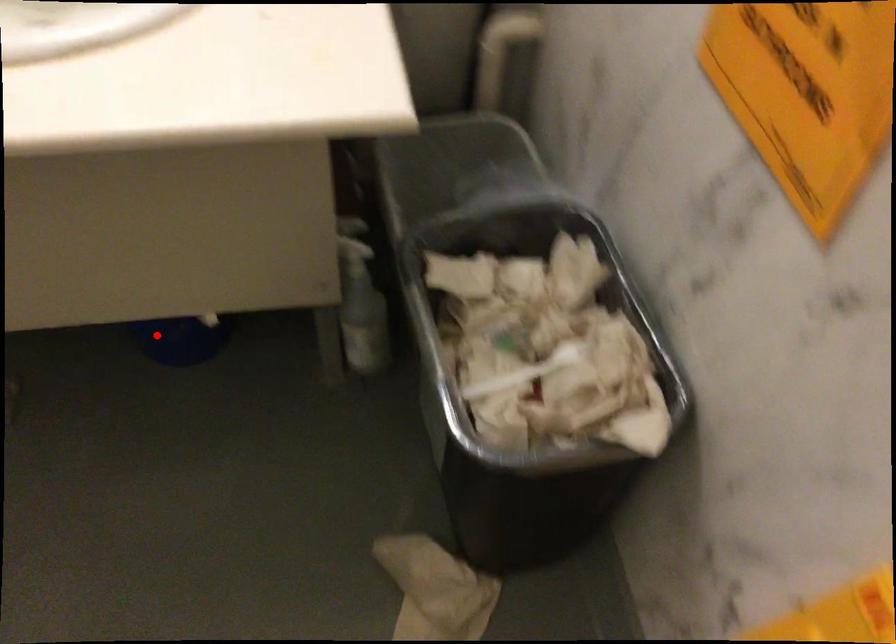
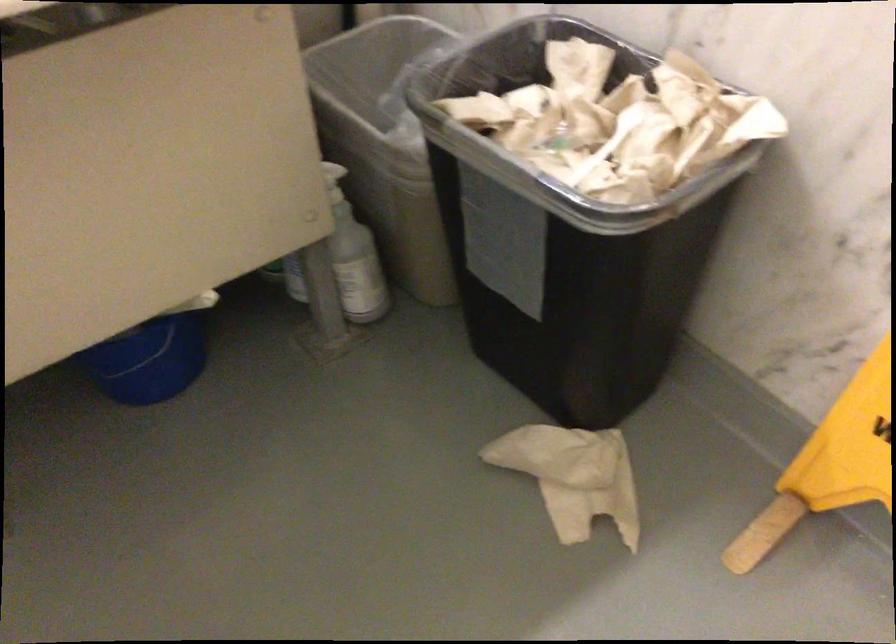
Question: I am providing you with two images of the same scene from different viewpoints. Image1 has a red point marked. In image2, the corresponding 3D location appears at what relative position? Reply with the corresponding letter.

Choices:
 (A) Closer
 (B) Farther

Answer: (A)